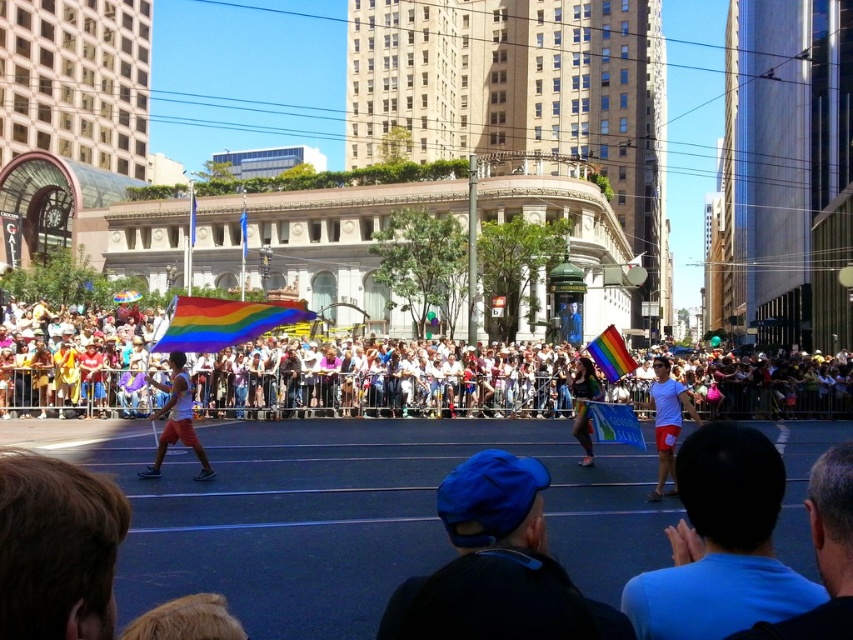
Is brown hair at lower left smaller than white matte shorts at left?

Correct, brown hair at lower left occupies less space than white matte shorts at left.

Image resolution: width=853 pixels, height=640 pixels. What do you see at coordinates (57, 548) in the screenshot? I see `brown hair at lower left` at bounding box center [57, 548].

Where is `brown hair at lower left`? brown hair at lower left is located at coordinates (57, 548).

Locate an element on the screen. The image size is (853, 640). brown hair at lower left is located at coordinates (57, 548).

Does blue fabric cap at center have a larger size compared to brown hair at lower left?

Indeed, blue fabric cap at center has a larger size compared to brown hair at lower left.

Between point (502, 609) and point (26, 593), which one is positioned behind?

Point (502, 609)

Which is in front, point (463, 628) or point (6, 602)?

Point (6, 602)

What are the coordinates of `blue fabric cap at center` in the screenshot? It's located at (496, 566).

Does white cotton crowd at center have a greater height compared to brown hair at lower left?

Yes, white cotton crowd at center is taller than brown hair at lower left.

Which is more to the right, white cotton crowd at center or brown hair at lower left?

white cotton crowd at center

Is point (305, 342) positioned in front of point (50, 484)?

No, it is behind (50, 484).

Where is `white cotton crowd at center`? white cotton crowd at center is located at coordinates (396, 378).